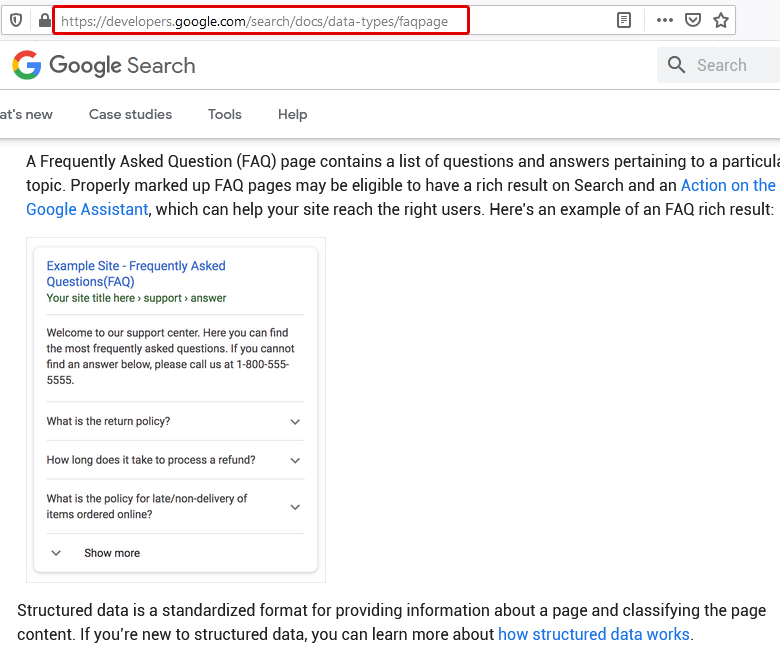
The height and width of the screenshot is (668, 780). Find the location of `lock`. lock is located at coordinates (44, 21).